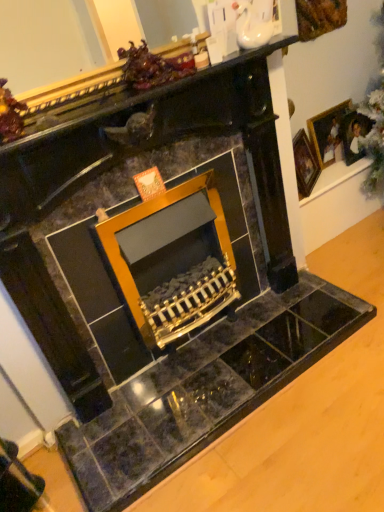
Question: From a real-world perspective, does gold-framed picture at upper right, which is the first picture frame from left to right, sit lower than wooden picture frame at upper right, which appears as the 2th picture frame when viewed from the left?

Choices:
 (A) yes
 (B) no

Answer: (A)

Question: Is gold-framed picture at upper right, acting as the second picture frame starting from the right, taller than wooden picture frame at upper right, which appears as the 2th picture frame when viewed from the left?

Choices:
 (A) no
 (B) yes

Answer: (B)

Question: Does gold-framed picture at upper right, which is the first picture frame from left to right, have a larger size compared to wooden picture frame at upper right, which appears as the 2th picture frame when viewed from the left?

Choices:
 (A) yes
 (B) no

Answer: (A)

Question: Is gold-framed picture at upper right, which is the first picture frame from left to right, positioned with its back to wooden picture frame at upper right, which appears as the 2th picture frame when viewed from the left?

Choices:
 (A) no
 (B) yes

Answer: (A)

Question: From the image's perspective, is gold-framed picture at upper right, acting as the second picture frame starting from the right, below wooden picture frame at upper right, which is the 1th picture frame from right to left?

Choices:
 (A) no
 (B) yes

Answer: (B)

Question: Is gold-framed picture at upper right, acting as the second picture frame starting from the right, not near wooden picture frame at upper right, which is the 1th picture frame from right to left?

Choices:
 (A) no
 (B) yes

Answer: (A)

Question: Can you confirm if wooden picture frame at upper right, which appears as the 2th picture frame when viewed from the left, is shorter than gold-framed picture at upper right, acting as the second picture frame starting from the right?

Choices:
 (A) no
 (B) yes

Answer: (B)

Question: Is wooden picture frame at upper right, which is the 1th picture frame from right to left, facing towards gold-framed picture at upper right, acting as the second picture frame starting from the right?

Choices:
 (A) no
 (B) yes

Answer: (A)

Question: Considering the relative sizes of wooden picture frame at upper right, which is the 1th picture frame from right to left, and gold-framed picture at upper right, which is the first picture frame from left to right, in the image provided, is wooden picture frame at upper right, which is the 1th picture frame from right to left, taller than gold-framed picture at upper right, which is the first picture frame from left to right,?

Choices:
 (A) no
 (B) yes

Answer: (A)

Question: Can you confirm if wooden picture frame at upper right, which is the 1th picture frame from right to left, is positioned to the left of gold-framed picture at upper right, acting as the second picture frame starting from the right?

Choices:
 (A) no
 (B) yes

Answer: (A)

Question: Considering the relative positions of wooden picture frame at upper right, which appears as the 2th picture frame when viewed from the left, and gold-framed picture at upper right, acting as the second picture frame starting from the right, in the image provided, is wooden picture frame at upper right, which appears as the 2th picture frame when viewed from the left, to the right of gold-framed picture at upper right, acting as the second picture frame starting from the right, from the viewer's perspective?

Choices:
 (A) no
 (B) yes

Answer: (B)

Question: Is wooden picture frame at upper right, which is the 1th picture frame from right to left, further to camera compared to gold-framed picture at upper right, which is the first picture frame from left to right?

Choices:
 (A) yes
 (B) no

Answer: (A)

Question: From the image's perspective, is wooden picture frame at upper right, which is the 1th picture frame from right to left, located above or below gold-framed picture at upper right, which is the first picture frame from left to right?

Choices:
 (A) below
 (B) above

Answer: (B)